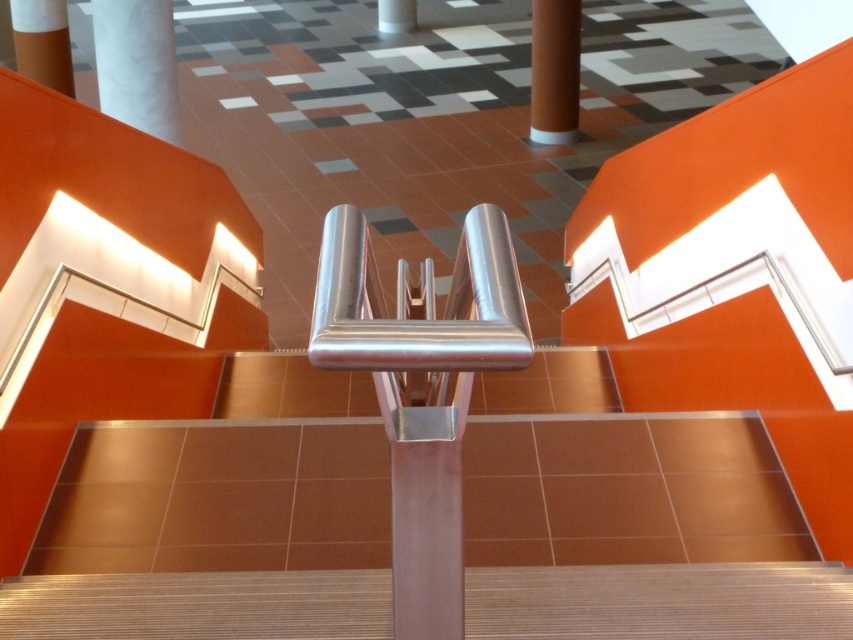
Consider the image. You are standing at the bottom of the staircase and want to reach the white matte pillar at upper left. Which direction should you move relative to the smooth white pillar at center?

You should move towards the upper left direction relative to the smooth white pillar at center because the white matte pillar at upper left is positioned under it.

You are an interior designer planning to place a new sculpture between the satin silver stair at center and the smooth white pillar at center. Which object should the sculpture be closer to if it needs to be positioned near the smaller one?

The sculpture should be placed closer to the satin silver stair at center because it is smaller than the smooth white pillar at center.

You are standing at the bottom of the staircase and want to reach the point marked at coordinates point (659, 602). Which object in the scene corresponds to that location?

The satin silver stair at center is located at point (659, 602).